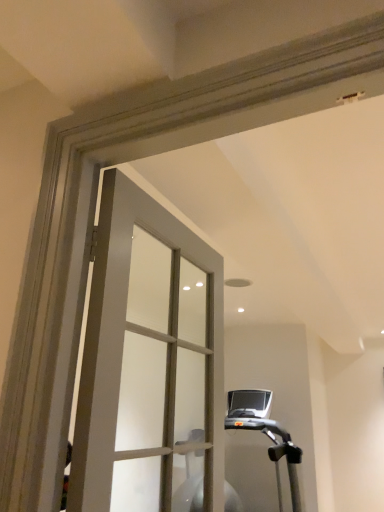
The width and height of the screenshot is (384, 512). What do you see at coordinates (149, 361) in the screenshot? I see `matte gray door at center` at bounding box center [149, 361].

Locate an element on the screen. This screenshot has height=512, width=384. matte gray door at center is located at coordinates (149, 361).

Where is `matte gray door at center`? The image size is (384, 512). matte gray door at center is located at coordinates (149, 361).